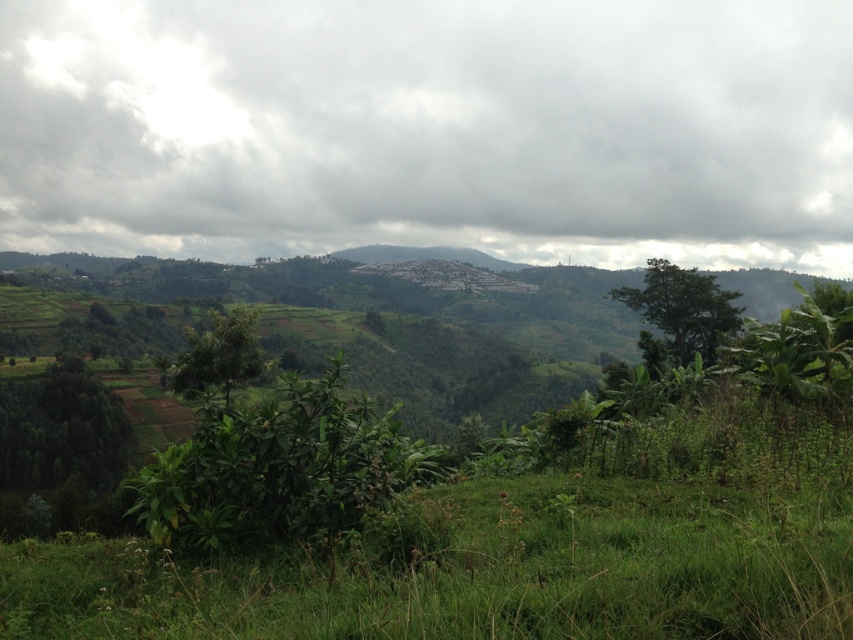
Based on the photo, you are standing in the lush landscape and want to move from the point at coordinates point (223, 118) to the point at coordinates point (173, 490). Which direction should you face to walk towards your destination?

Since point (223, 118) is closer to you than point (173, 490), you should face away from yourself towards the point (173, 490) to walk towards it.

You are standing in the lush landscape and want to take a photo of the cloudy sky at upper center and the green leafy bush at center. Which object will appear larger in the photo?

The cloudy sky at upper center will appear larger in the photo because it is bigger than the green leafy bush at center.

You are standing in the lush landscape described and want to take a photo of the cloudy sky at upper center. To ensure you capture it in the frame, where should you position your camera relative to the scene?

The cloudy sky at upper center is located at coordinates point 0.203 on the horizontal axis and 0.505 on the vertical axis. Position your camera slightly to the left and centered vertically to capture it.